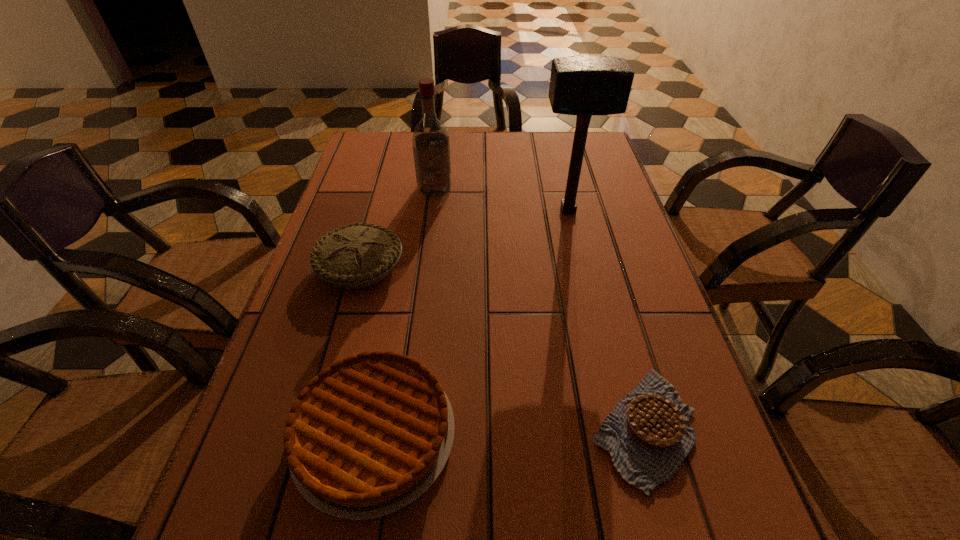
Where is `blank space located on the left of the rightmost pie`? This screenshot has height=540, width=960. blank space located on the left of the rightmost pie is located at coordinates (391, 428).

This screenshot has height=540, width=960. In order to click on mallet that is at the right edge in this screenshot , I will do `click(584, 86)`.

Where is `pie that is at the right edge`? pie that is at the right edge is located at coordinates (648, 434).

Identify the location of vacant area at the far edge. (516, 154).

You are a GUI agent. You are given a task and a screenshot of the screen. Output one action in this format:
    pyautogui.click(x=<x>, y=<y>)
    Task: Click on the vacant space at the left edge of the desktop
    Image resolution: width=960 pixels, height=540 pixels.
    Given the screenshot: What is the action you would take?
    pyautogui.click(x=394, y=206)

Image resolution: width=960 pixels, height=540 pixels. What are the coordinates of `free space at the right edge of the desktop` in the screenshot? It's located at (x=646, y=494).

Locate an element on the screen. The width and height of the screenshot is (960, 540). vacant space at the far left corner of the desktop is located at coordinates (385, 138).

In the image, there is a desktop. Identify the location of vacant space at the far right corner. This screenshot has height=540, width=960. (552, 138).

At what (x,y) coordinates should I click in order to perform the action: click on free spot between the farthest object and the tallest object. Please return your answer as a coordinate pair (x, y). Looking at the image, I should click on (501, 199).

Find the location of a particular element. vacant space that is in between the third nearest object and the tallest object is located at coordinates (465, 238).